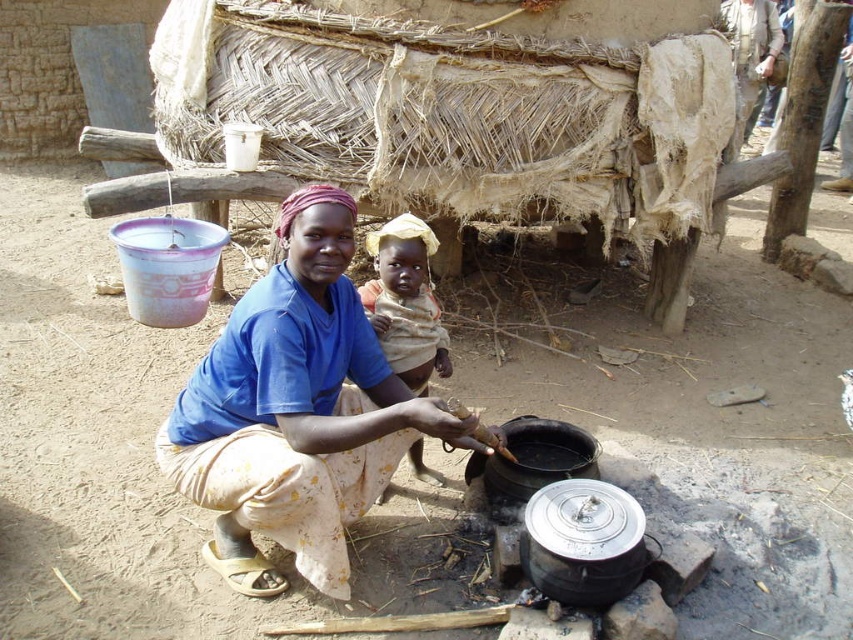
Question: Which point appears farthest from the camera in this image?

Choices:
 (A) (189, 444)
 (B) (376, 276)

Answer: (B)

Question: Considering the relative positions of blue fabric at center and light brown fabric baby at center in the image provided, where is blue fabric at center located with respect to light brown fabric baby at center?

Choices:
 (A) left
 (B) right

Answer: (A)

Question: Is blue fabric at center to the left of light brown fabric baby at center from the viewer's perspective?

Choices:
 (A) no
 (B) yes

Answer: (B)

Question: Can you confirm if blue fabric at center is wider than light brown fabric baby at center?

Choices:
 (A) yes
 (B) no

Answer: (A)

Question: Which point is closer to the camera?

Choices:
 (A) (401, 310)
 (B) (271, 460)

Answer: (B)

Question: Which object is closer to the camera taking this photo?

Choices:
 (A) light brown fabric baby at center
 (B) blue fabric at center

Answer: (B)